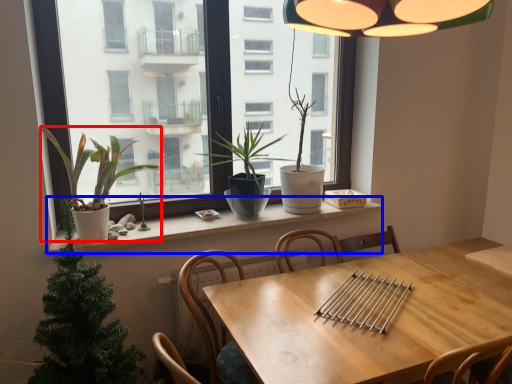
Question: Which of the following is the farthest to the observer, houseplant (highlighted by a red box) or window sill (highlighted by a blue box)?

Choices:
 (A) houseplant
 (B) window sill

Answer: (B)